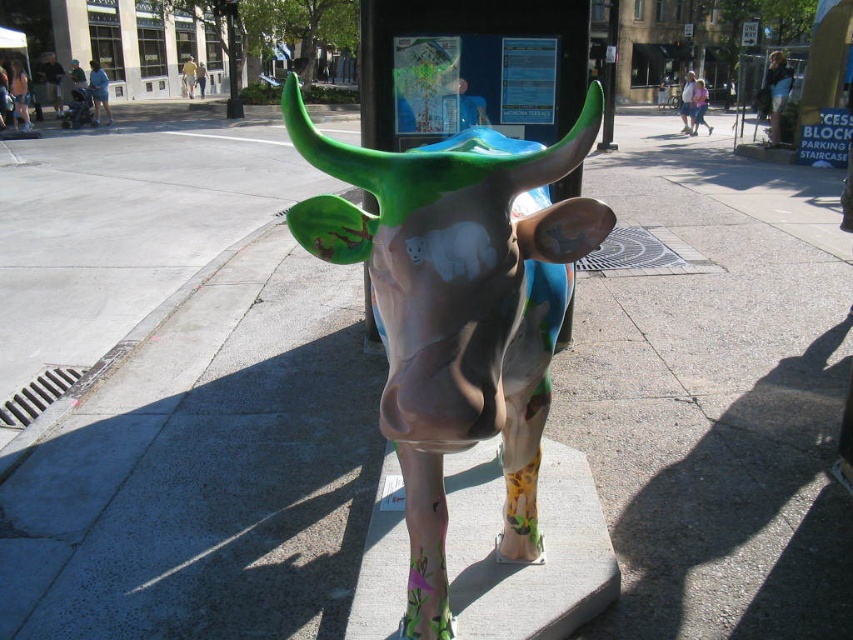
Question: Among these objects, which one is farthest from the camera?

Choices:
 (A) painted ceramic cow at center
 (B) matte plastic cow at center

Answer: (B)

Question: Can you confirm if painted ceramic cow at center is positioned below matte plastic cow at center?

Choices:
 (A) yes
 (B) no

Answer: (A)

Question: Is the position of painted ceramic cow at center more distant than that of matte plastic cow at center?

Choices:
 (A) no
 (B) yes

Answer: (A)

Question: Which of the following is the farthest from the observer?

Choices:
 (A) (404, 428)
 (B) (584, 77)

Answer: (B)

Question: Which object is closer to the camera taking this photo?

Choices:
 (A) matte plastic cow at center
 (B) painted ceramic cow at center

Answer: (B)

Question: Does painted ceramic cow at center have a larger size compared to matte plastic cow at center?

Choices:
 (A) yes
 (B) no

Answer: (A)